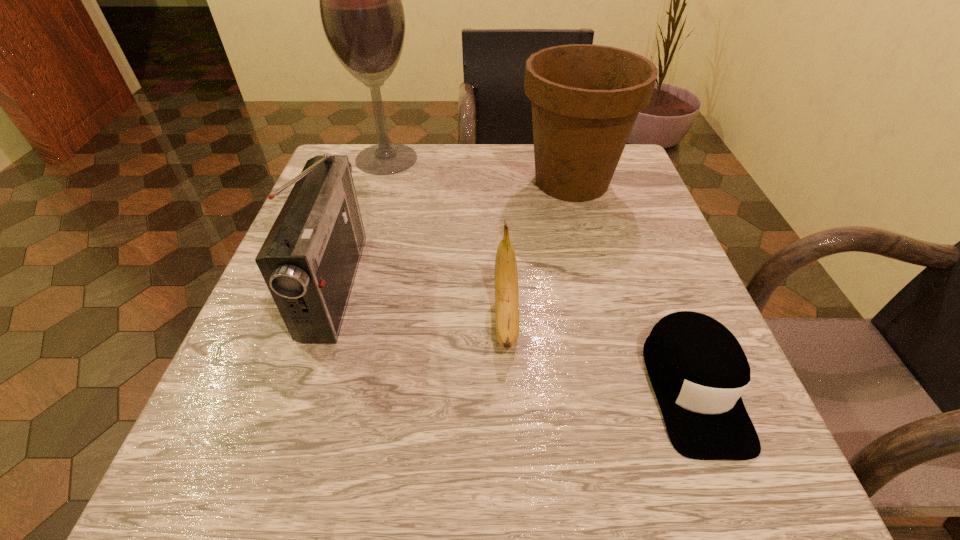
Image resolution: width=960 pixels, height=540 pixels. What are the coordinates of `alcohol` in the screenshot? It's located at (360, 0).

Find the location of `radio receiver`. radio receiver is located at coordinates (309, 260).

Identify the location of flowerpot. (585, 98).

You are a GUI agent. You are given a task and a screenshot of the screen. Output one action in this format:
    pyautogui.click(x=<x>, y=<y>)
    Task: Click on the banana
    
    Given the screenshot: What is the action you would take?
    tap(506, 277)

Image resolution: width=960 pixels, height=540 pixels. Identify the location of the second shortest object. (506, 277).

Image resolution: width=960 pixels, height=540 pixels. I want to click on the shortest object, so click(698, 370).

This screenshot has width=960, height=540. I want to click on vacant space located 0.340m on the front of the alcohol, so click(x=350, y=284).

Identify the location of free location located 0.090m on the front-facing side of the radio receiver. (407, 285).

At what (x,y) coordinates should I click in order to perform the action: click on free space located 0.060m on the left of the flowerpot. Please return your answer as a coordinate pair (x, y). This screenshot has width=960, height=540. Looking at the image, I should click on (492, 181).

Where is `free location located 0.160m at the start of the peel on the banana`? free location located 0.160m at the start of the peel on the banana is located at coordinates (515, 474).